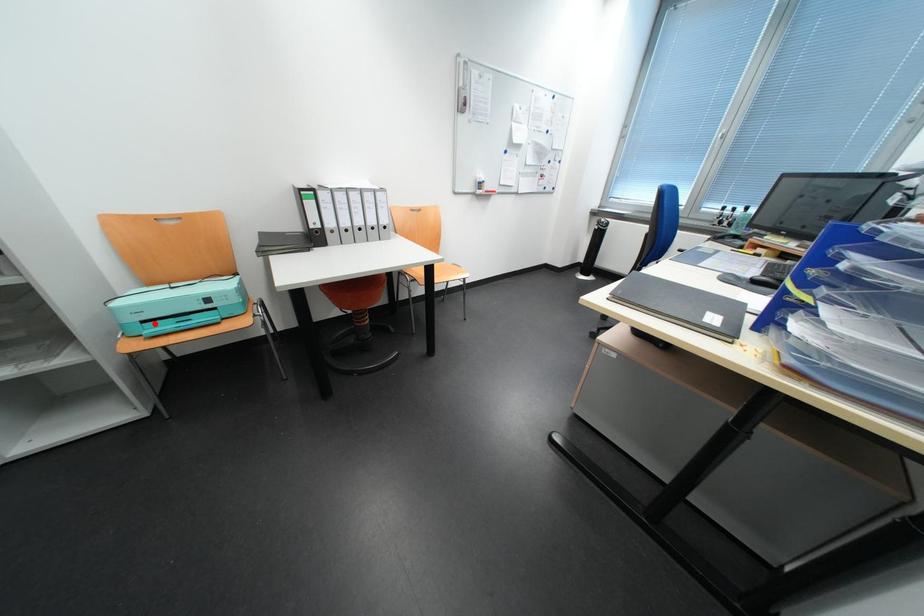
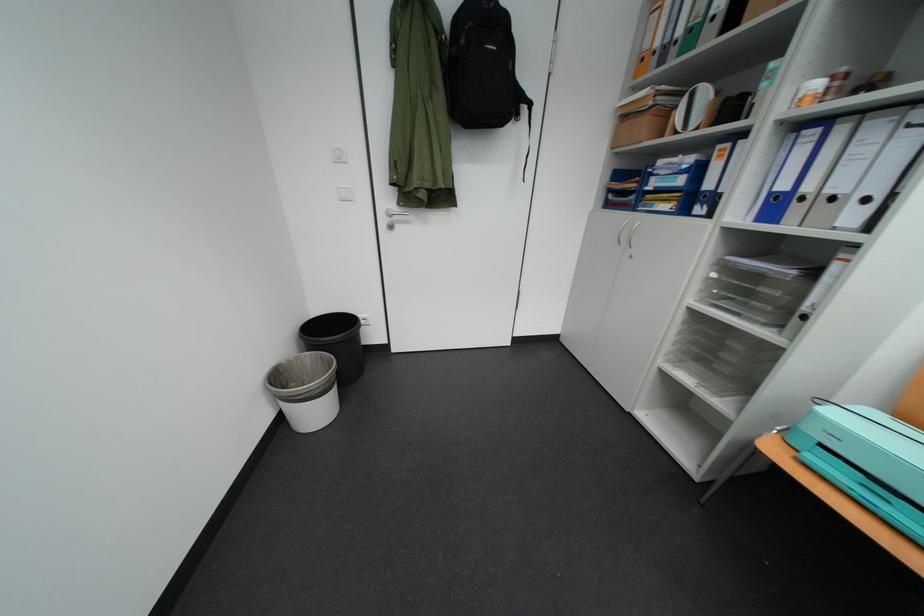
Locate, in the second image, the point that corresponds to the highlighted location in the first image.

(833, 447)